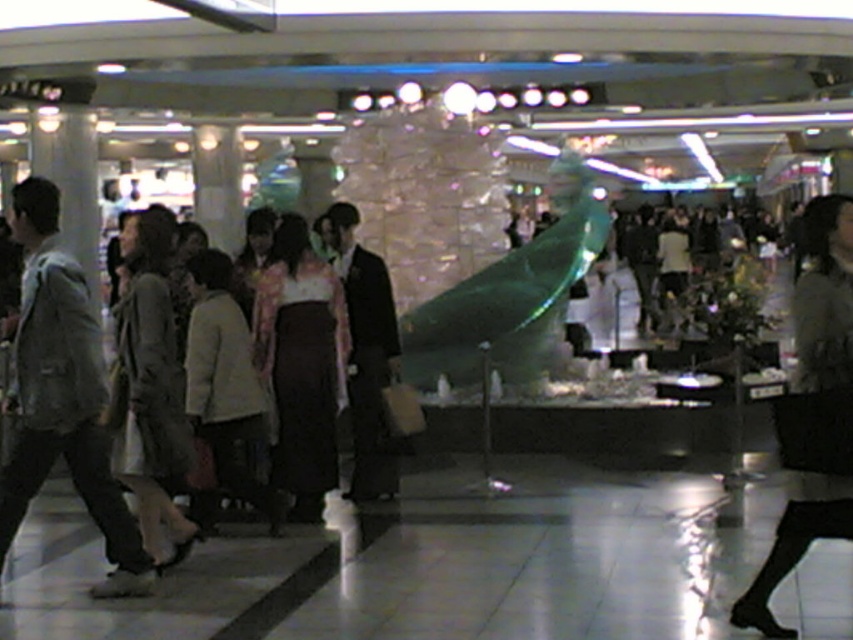
Is point (825, 198) more distant than point (132, 438)?

That is False.

Is dark gray sweater at center further to the viewer compared to light beige coat at center?

That is False.

Find the location of a particular element. The height and width of the screenshot is (640, 853). dark gray sweater at center is located at coordinates (811, 408).

Which is below, light beige coat at center or light beige fabric coat at center?

Positioned lower is light beige fabric coat at center.

Does light beige coat at center appear over light beige fabric coat at center?

Correct, light beige coat at center is located above light beige fabric coat at center.

Identify the location of light beige coat at center. (151, 387).

Which of these two, floral kimono at center or light beige fabric coat at center, stands taller?

With more height is floral kimono at center.

Does floral kimono at center come in front of light beige fabric coat at center?

No, floral kimono at center is behind light beige fabric coat at center.

Is point (293, 244) positioned behind point (231, 378)?

Yes, it is.

The width and height of the screenshot is (853, 640). Find the location of `floral kimono at center`. floral kimono at center is located at coordinates (300, 364).